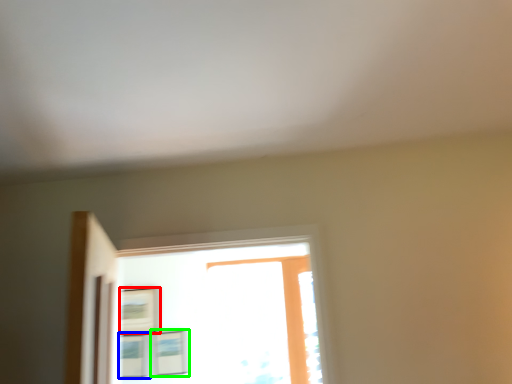
Question: Which is farther away from picture frame (highlighted by a red box)? picture frame (highlighted by a blue box) or picture frame (highlighted by a green box)?

Choices:
 (A) picture frame
 (B) picture frame

Answer: (B)